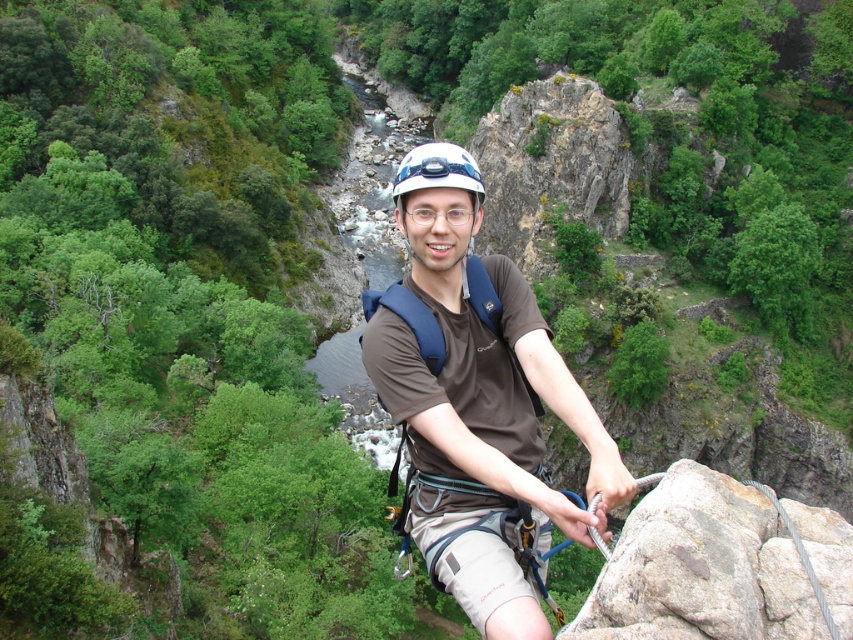
You are a photographer positioned at the camera mounted on the climber. You want to take a photo of two points in the scene. The first point is at coordinate point[525,484] and the second is at point[419,166]. Which point will appear larger in your photo?

Point[525,484] will appear larger in the photo because it is closer to the camera than point[419,166].

You are a photographer trying to capture a closeup of the climber. You notice the brown fabric shirt at center and the white matte helmet at center. Which object should you focus on if you want to photograph the part of the climber that is closer to the right edge of the frame?

The brown fabric shirt at center is positioned on the right side of the white matte helmet at center, so focusing on the brown fabric shirt at center will capture the part of the climber closer to the right edge of the frame.

You are a safety inspector assessing the climbing gear. You notice the brown fabric shirt at center and the white matte helmet at center. Which item has a smaller width when viewed from the front?

The brown fabric shirt at center is thinner than the white matte helmet at center, so the brown fabric shirt at center has a smaller width when viewed from the front.